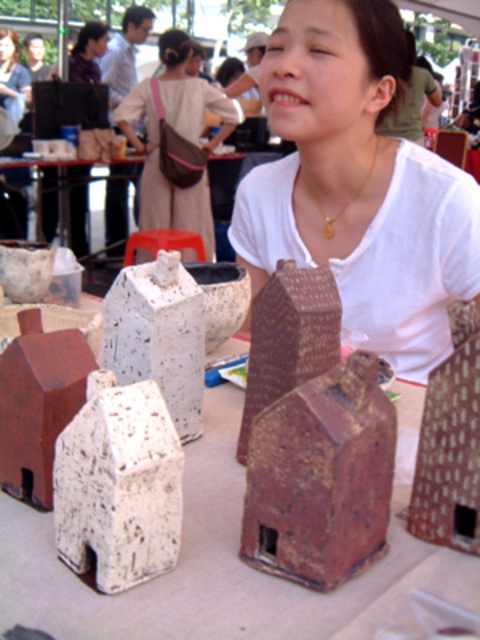
Can you confirm if matte white house at center is positioned to the right of brown speckled clay houses at center?

Correct, you'll find matte white house at center to the right of brown speckled clay houses at center.

Does matte white house at center have a greater width compared to brown speckled clay houses at center?

In fact, matte white house at center might be narrower than brown speckled clay houses at center.

The image size is (480, 640). Identify the location of matte white house at center. tap(358, 186).

Is brown speckled clay houses at center shorter than matte brown bag at upper left?

Correct, brown speckled clay houses at center is not as tall as matte brown bag at upper left.

Find the location of a particular element. The height and width of the screenshot is (640, 480). brown speckled clay houses at center is located at coordinates (216, 566).

Consider the image. Can you confirm if brown speckled clay houses at center is smaller than matte brown bag at upper center?

Correct, brown speckled clay houses at center occupies less space than matte brown bag at upper center.

Does brown speckled clay houses at center appear on the right side of matte brown bag at upper center?

Indeed, brown speckled clay houses at center is positioned on the right side of matte brown bag at upper center.

Who is more forward, (x=7, y=531) or (x=144, y=184)?

Positioned in front is point (x=7, y=531).

At what (x,y) coordinates should I click in order to perform the action: click on brown speckled clay houses at center. Please return your answer as a coordinate pair (x, y). This screenshot has height=640, width=480. Looking at the image, I should click on [x=216, y=566].